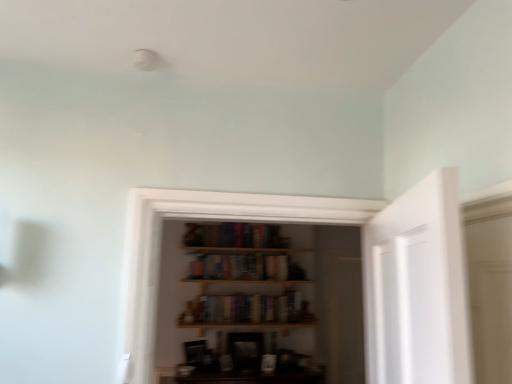
Locate an element on the screen. free space above hardcover books at center, which is counted as the 2th book, starting from the bottom (from a real-world perspective) is located at coordinates [237, 255].